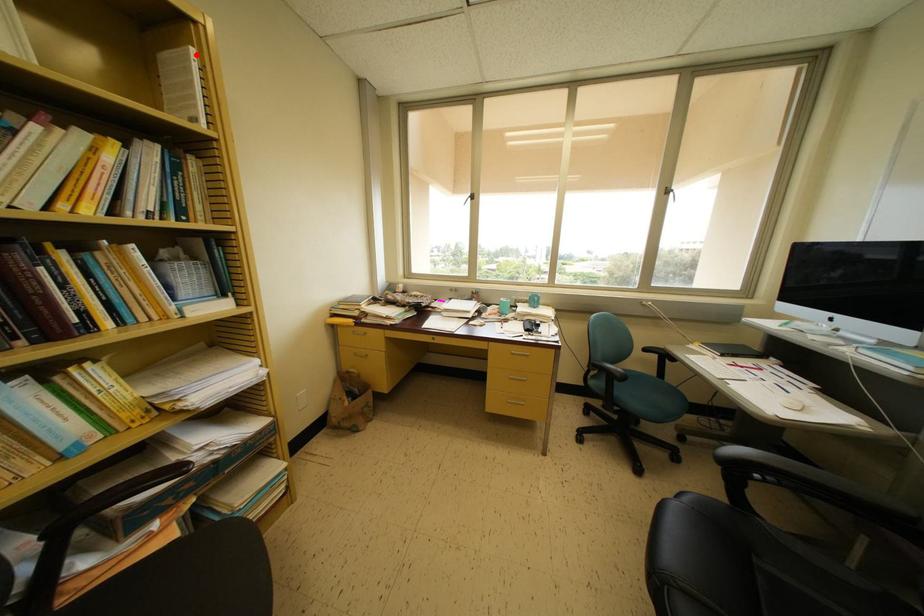
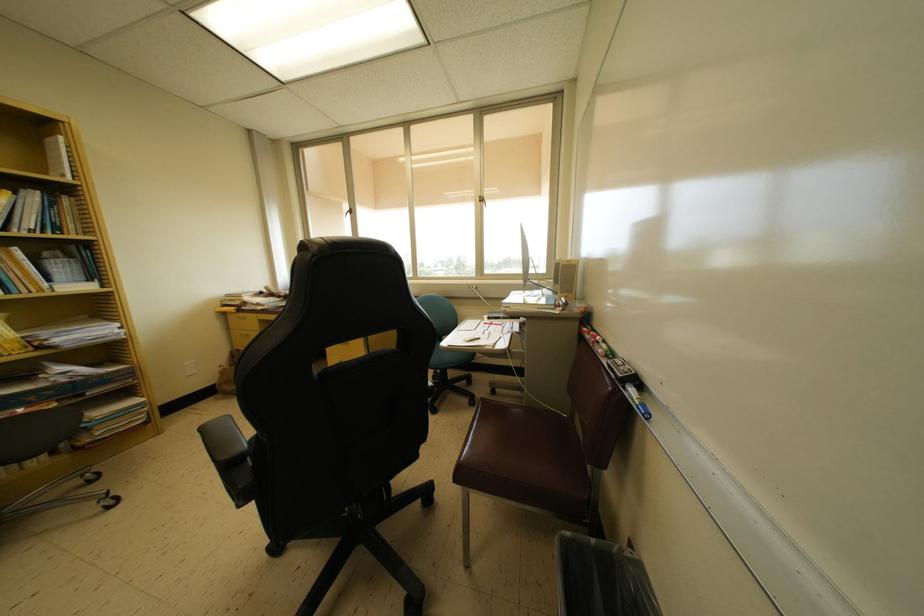
Where in the second image is the point corresponding to the highlighted location from the first image?

(65, 143)